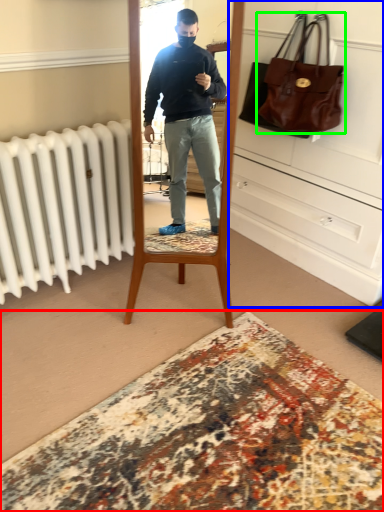
Question: Considering the real-world distances, which object is farthest from plain (highlighted by a red box)? dresser (highlighted by a blue box) or handbag (highlighted by a green box)?

Choices:
 (A) dresser
 (B) handbag

Answer: (B)